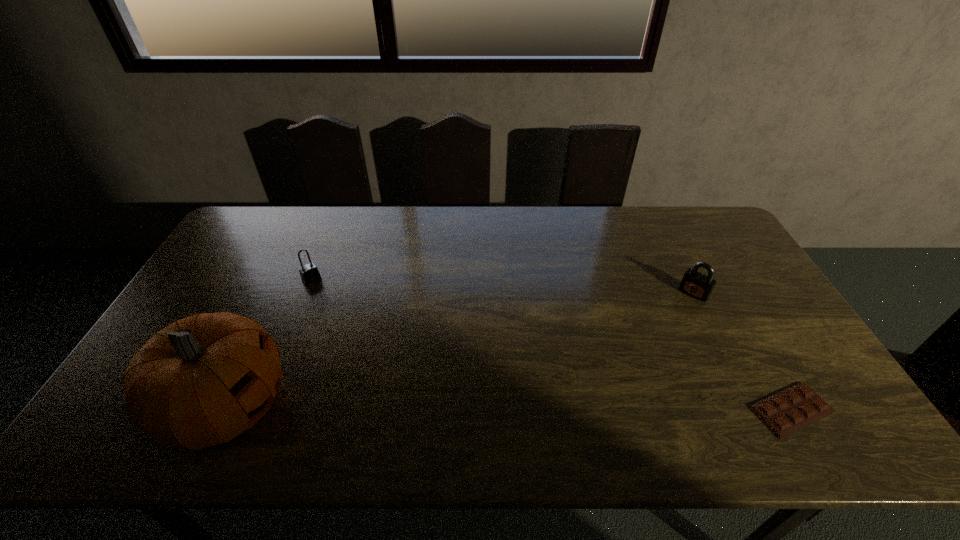
This screenshot has height=540, width=960. Identify the location of free space at the left edge of the desktop. (256, 255).

Find the location of `vacant region at the right edge of the desktop`. vacant region at the right edge of the desktop is located at coordinates (769, 342).

I want to click on vacant space at the far left corner of the desktop, so click(252, 244).

Identify the location of free area in between the left padlock and the chocolate bar. This screenshot has height=540, width=960. (551, 345).

Find the location of a particular element. The image size is (960, 540). empty space between the right padlock and the shortest object is located at coordinates (742, 352).

Identify the location of vacant region between the tallest object and the shortest object. (510, 408).

In order to click on free space between the right padlock and the left padlock in this screenshot , I will do tap(503, 286).

The image size is (960, 540). What are the coordinates of `vacant space in between the tallest object and the right padlock` in the screenshot? It's located at (461, 350).

The height and width of the screenshot is (540, 960). I want to click on free space between the left padlock and the right padlock, so click(503, 286).

Locate an element on the screen. The width and height of the screenshot is (960, 540). free space between the shortest object and the tallest object is located at coordinates (510, 408).